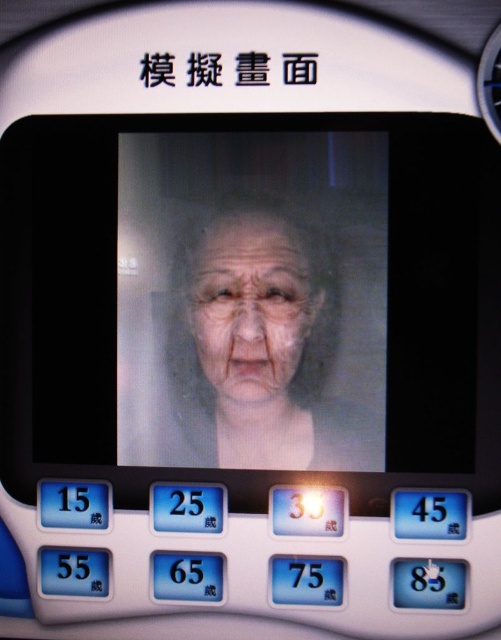
Which is behind, point (235, 260) or point (201, 236)?

Point (235, 260)

What do you see at coordinates (256, 346) in the screenshot? I see `matte gray face at center` at bounding box center [256, 346].

At what (x,y) coordinates should I click in order to perform the action: click on matte gray face at center. Please return your answer as a coordinate pair (x, y). Looking at the image, I should click on (256, 346).